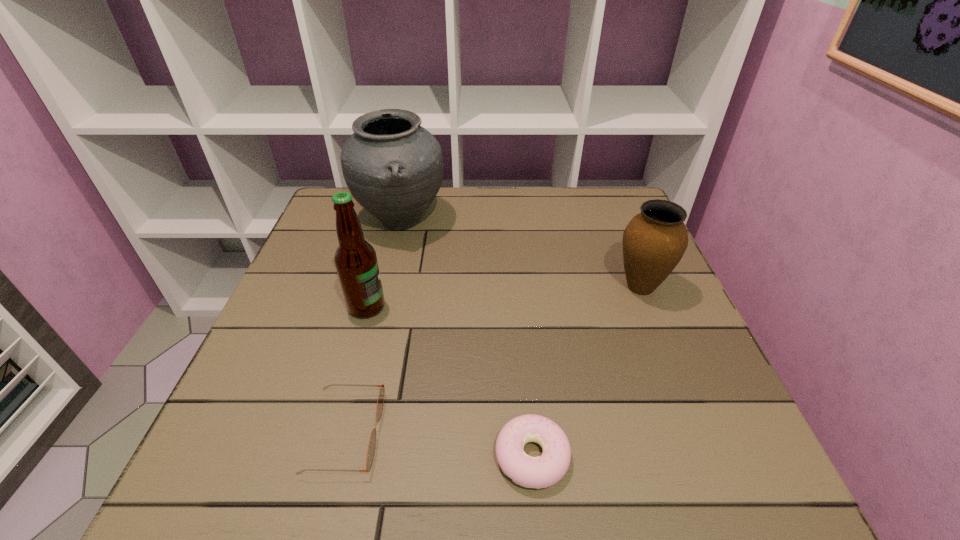
In order to click on the left urn in this screenshot , I will do `click(393, 167)`.

The height and width of the screenshot is (540, 960). I want to click on the farther urn, so click(x=393, y=167).

Identify the location of beer bottle. (355, 259).

In order to click on the third tallest object in this screenshot , I will do `click(654, 241)`.

Where is `the right urn`? the right urn is located at coordinates (654, 241).

Locate an element on the screen. This screenshot has height=540, width=960. sunglasses is located at coordinates (372, 442).

You are a GUI agent. You are given a task and a screenshot of the screen. Output one action in this format:
    pyautogui.click(x=<x>, y=<y>)
    Task: Click on the doughnut
    
    Given the screenshot: What is the action you would take?
    pyautogui.click(x=543, y=471)

Find the location of `vacant space located on the left of the farther urn`. vacant space located on the left of the farther urn is located at coordinates (326, 221).

This screenshot has width=960, height=540. Find the location of `free spot located on the label of the beer bottle`. free spot located on the label of the beer bottle is located at coordinates (426, 307).

Locate an element on the screen. The width and height of the screenshot is (960, 540). free location located 0.290m on the left of the right urn is located at coordinates (487, 287).